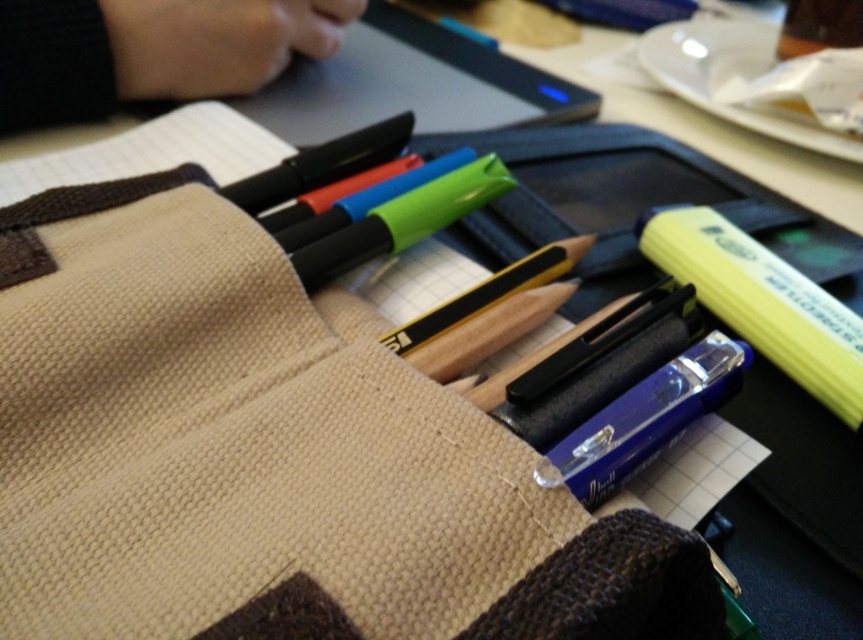
You are organizing your desk and need to know the position of the highlighters. Are the green matte highlighter at center and the matte blue highlighter at upper center arranged vertically or horizontally?

The green matte highlighter at center is positioned under the matte blue highlighter at upper center, so they are arranged vertically.

You are organizing the contents of the beige fabric pencil case. You need to place a new sticker exactly halfway between point (564,480) and point (400,330). Where would this midpoint be located?

The midpoint between point (564,480) and point (400,330) is calculated by averaging the coordinates. The x coordinate is 0.750 and 0.516 averaged to 0.633, and the y coordinate is 0.654 and 0.465 averaged to 0.5595. Therefore, the midpoint is at approximately point 0.633, 0.560.

You are organizing your desk and need to place a new pen between the matte black pencil at center and the matte blue highlighter at upper center. Based on their positions, where should you place the pen?

The matte black pencil at center is closer to you than the matte blue highlighter at upper center, so you should place the pen between them by positioning it closer to the matte blue highlighter at upper center to maintain the spatial order.